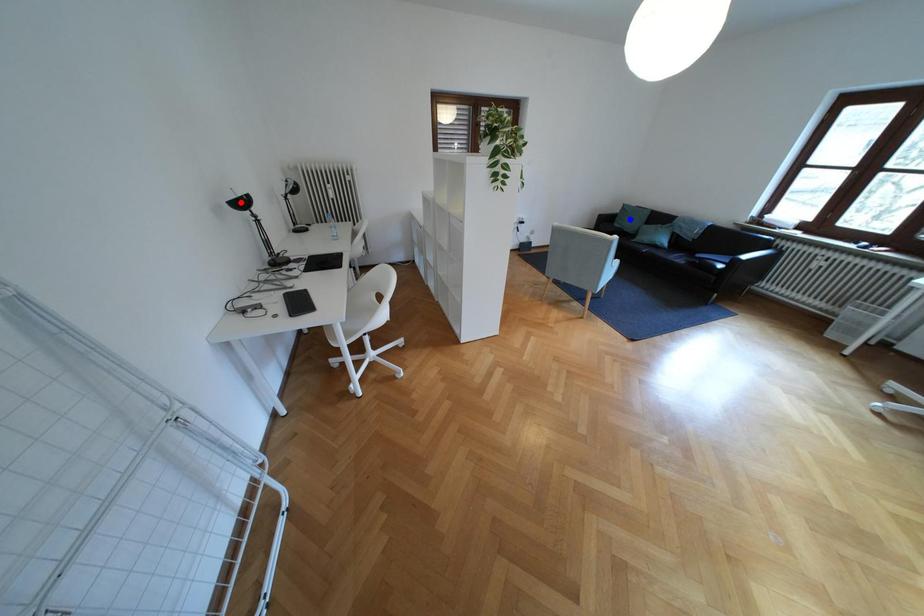
Question: Two points are marked on the image. Which point is closer to the camera?

Choices:
 (A) Blue point is closer.
 (B) Red point is closer.

Answer: (B)